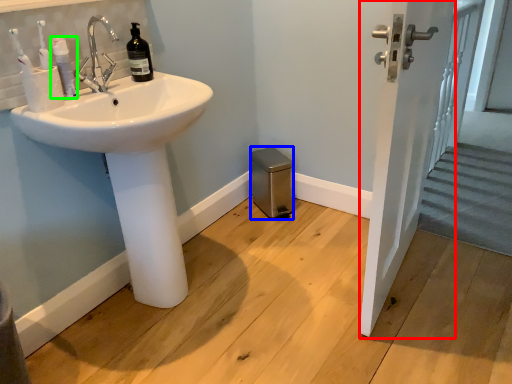
Question: Which is farther away from screen door (highlighted by a red box)? bidet (highlighted by a blue box) or toiletry (highlighted by a green box)?

Choices:
 (A) bidet
 (B) toiletry

Answer: (B)